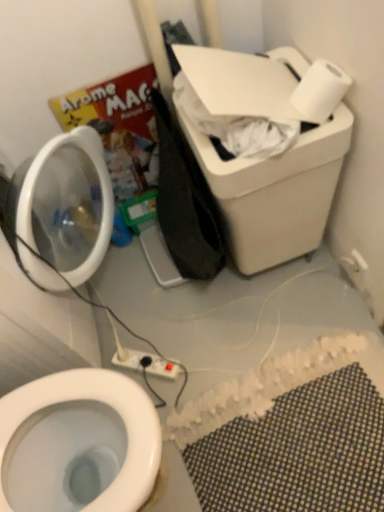
Question: Would you say white plastic electric outlet at upper right, placed as the first electric outlet when sorted from top to bottom, contains white plastic power strip at lower center, arranged as the first electric outlet when ordered from the bottom?

Choices:
 (A) yes
 (B) no

Answer: (B)

Question: From the image's perspective, would you say white plastic electric outlet at upper right, placed as the first electric outlet when sorted from top to bottom, is shown under white plastic power strip at lower center, the 2th electric outlet when ordered from right to left?

Choices:
 (A) yes
 (B) no

Answer: (B)

Question: Is white plastic electric outlet at upper right, which is the second electric outlet in left-to-right order, turned away from white plastic power strip at lower center, the 2th electric outlet when ordered from right to left?

Choices:
 (A) yes
 (B) no

Answer: (B)

Question: Can you confirm if white plastic electric outlet at upper right, placed as the first electric outlet when sorted from top to bottom, is bigger than white plastic power strip at lower center, arranged as the first electric outlet when viewed from the left?

Choices:
 (A) no
 (B) yes

Answer: (A)

Question: Does white plastic electric outlet at upper right, placed as the first electric outlet when sorted from top to bottom, have a greater width compared to white plastic power strip at lower center, the 2th electric outlet when ordered from right to left?

Choices:
 (A) no
 (B) yes

Answer: (A)

Question: Looking at their shapes, would you say white matte toilet paper at upper right is wider or thinner than white plastic electric outlet at upper right, placed as the first electric outlet when sorted from top to bottom?

Choices:
 (A) thin
 (B) wide

Answer: (B)

Question: From a real-world perspective, relative to white plastic electric outlet at upper right, which is the second electric outlet in left-to-right order, is white matte toilet paper at upper right vertically above or below?

Choices:
 (A) above
 (B) below

Answer: (A)

Question: Considering the relative positions of white matte toilet paper at upper right and white plastic electric outlet at upper right, placed as the first electric outlet when sorted from top to bottom, in the image provided, is white matte toilet paper at upper right to the left or to the right of white plastic electric outlet at upper right, placed as the first electric outlet when sorted from top to bottom,?

Choices:
 (A) left
 (B) right

Answer: (A)

Question: Does point (327, 74) appear closer or farther from the camera than point (349, 264)?

Choices:
 (A) farther
 (B) closer

Answer: (B)

Question: Considering the positions of white matte toilet paper at upper right and white plastic power strip at lower center, the 2th electric outlet when ordered from right to left, in the image, is white matte toilet paper at upper right bigger or smaller than white plastic power strip at lower center, the 2th electric outlet when ordered from right to left,?

Choices:
 (A) big
 (B) small

Answer: (A)

Question: From the image's perspective, is white matte toilet paper at upper right positioned above or below white plastic power strip at lower center, the 2th electric outlet when ordered from right to left?

Choices:
 (A) below
 (B) above

Answer: (B)

Question: Considering the positions of point (302, 110) and point (144, 361), is point (302, 110) closer or farther from the camera than point (144, 361)?

Choices:
 (A) closer
 (B) farther

Answer: (A)

Question: In terms of height, does white matte toilet paper at upper right look taller or shorter compared to white plastic power strip at lower center, the 2th electric outlet when ordered from right to left?

Choices:
 (A) tall
 (B) short

Answer: (A)

Question: From the image's perspective, is white matte toilet paper at upper right above or below white mesh bath mat at lower right?

Choices:
 (A) below
 (B) above

Answer: (B)

Question: Visually, is white matte toilet paper at upper right positioned to the left or to the right of white mesh bath mat at lower right?

Choices:
 (A) left
 (B) right

Answer: (B)